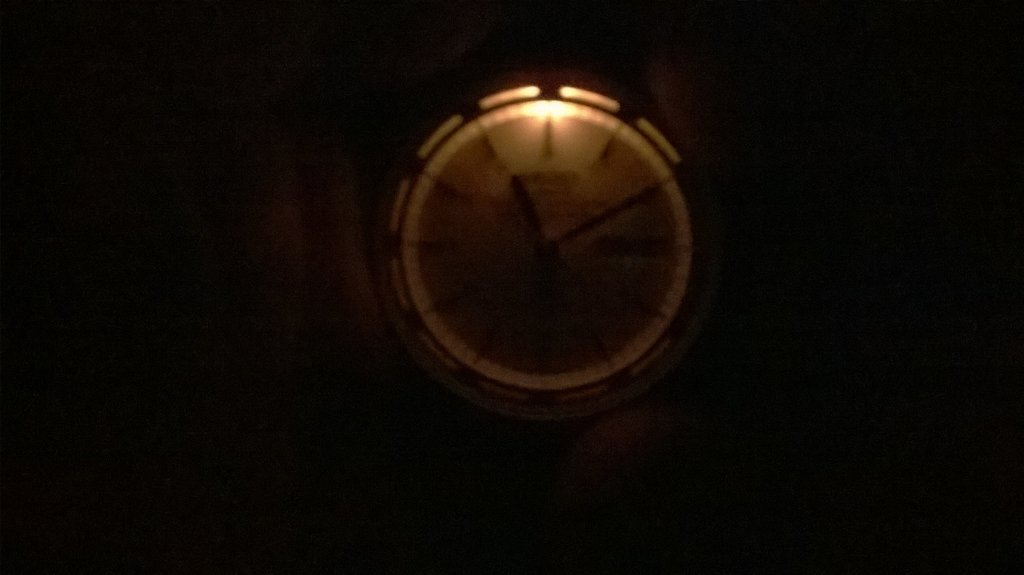
Locate an element on the screen. clock is located at coordinates (620, 242).